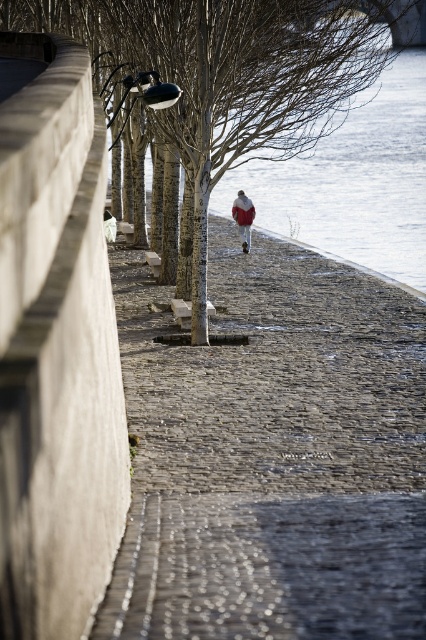
In the scene shown: You are standing at the camera position looking at the riverside scene. There is a point marked at coordinates point (123, 369). Can you reach this point without crossing the concrete wall or the river?

The point (123, 369) is 49.06 feet away from the camera. Since the concrete wall is parallel to the path and the river is on the other side of the wall, you can reach the point by walking along the cobblestone pathway without crossing the wall or the river.

Based on the photo, you are a pedestrian walking along the gray cobblestone pavement at center and the brown bark tree at center. Which object is located to the left side from your perspective?

The gray cobblestone pavement at center is to the left of the brown bark tree at center, so from your perspective, the gray cobblestone pavement at center would be on the left side.

You are standing at the point marked as point (273, 454) in the image. What type of surface are you currently standing on?

You are standing on the gray cobblestone pavement at center.